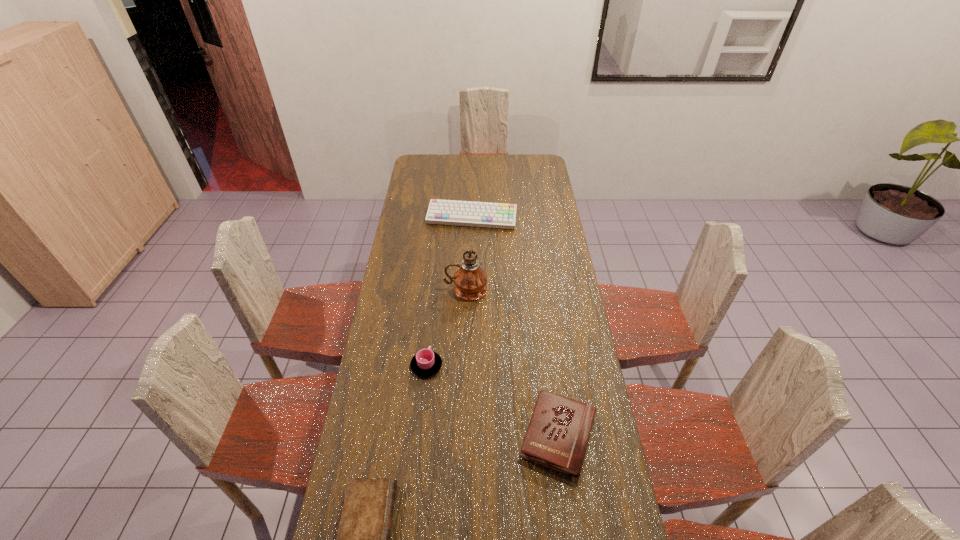
What are the coordinates of `oil lamp` in the screenshot? It's located at (470, 280).

Where is `the fourth nearest object`? Image resolution: width=960 pixels, height=540 pixels. the fourth nearest object is located at coordinates (470, 280).

Where is `the farthest object`? The image size is (960, 540). the farthest object is located at coordinates (445, 212).

At what (x,y) coordinates should I click in order to perform the action: click on the third nearest object. Please return your answer as a coordinate pair (x, y). Image resolution: width=960 pixels, height=540 pixels. Looking at the image, I should click on (425, 363).

Identify the location of the fourth farthest object. (557, 437).

At what (x,y) coordinates should I click in order to perform the action: click on vacant area situated on the back of the oil lamp. Please return your answer as a coordinate pair (x, y). The width and height of the screenshot is (960, 540). Looking at the image, I should click on (468, 235).

In order to click on vacant space situated 0.100m on the back of the farthest object in this screenshot , I will do [472, 195].

The image size is (960, 540). Identify the location of vacant space located on the side with the handle of the third farthest object. (430, 327).

The width and height of the screenshot is (960, 540). What are the coordinates of `vacant space located on the side with the handle of the third farthest object` in the screenshot? It's located at click(x=430, y=332).

Image resolution: width=960 pixels, height=540 pixels. I want to click on blank space located 0.110m on the side with the handle of the third farthest object, so click(x=430, y=329).